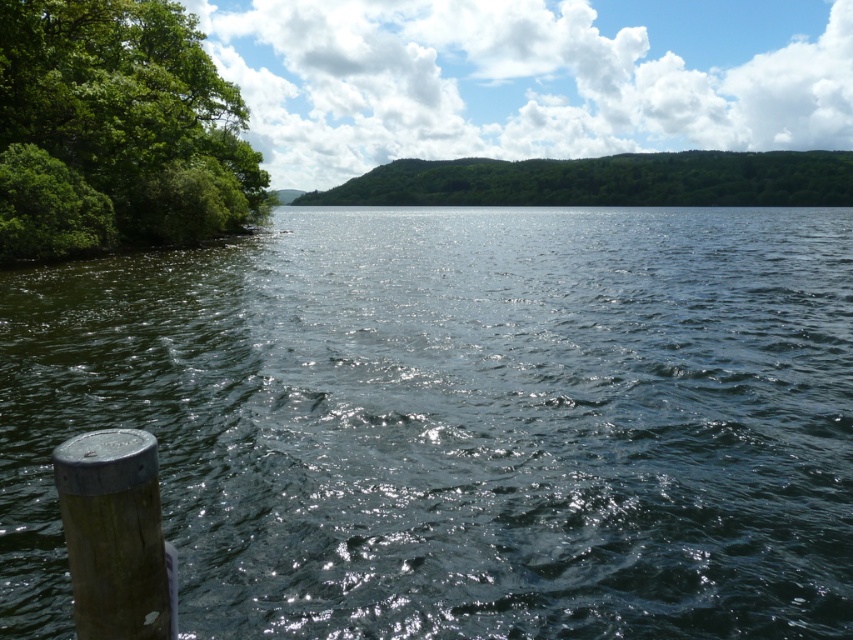
You are standing on the lakeside and want to take a photo of the wooden post at lower left and the dark green water at center. Which object should you focus on first if you want to capture both in a single frame without moving the camera?

The wooden post at lower left should be focused on first because it is closer to the viewer than the dark green water at center, allowing both to be in the frame without moving the camera.

You are standing at the lakeside and want to walk from the wooden post at lower left to the green leafy bush at left. Which direction should you move in relation to the post?

The green leafy bush at left is positioned over the wooden post at lower left, so you should move upwards from the wooden post at lower left to reach the green leafy bush at left.